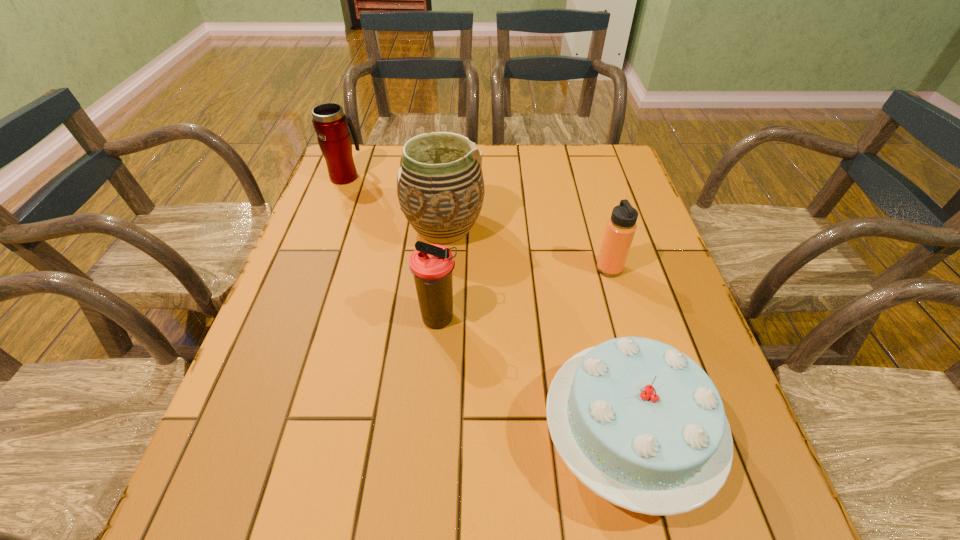
Where is `vacant space located 0.120m on the side with the handle of the farthest thermos bottle`? The width and height of the screenshot is (960, 540). vacant space located 0.120m on the side with the handle of the farthest thermos bottle is located at coordinates (356, 147).

Where is `vacant area situated 0.100m on the side with the handle of the farthest thermos bottle`? Image resolution: width=960 pixels, height=540 pixels. vacant area situated 0.100m on the side with the handle of the farthest thermos bottle is located at coordinates click(355, 150).

This screenshot has height=540, width=960. What are the coordinates of `free space located 0.140m on the front of the second thermos bottle from left to right` in the screenshot? It's located at (432, 399).

Where is `free spot located on the back of the rightmost thermos bottle`? free spot located on the back of the rightmost thermos bottle is located at coordinates (598, 228).

Locate an element on the screen. The width and height of the screenshot is (960, 540). vacant space located on the left of the nearest object is located at coordinates (429, 438).

You are a GUI agent. You are given a task and a screenshot of the screen. Output one action in this format:
    pyautogui.click(x=<x>, y=<y>)
    Task: Click on the object that is at the far edge
    
    Given the screenshot: What is the action you would take?
    pyautogui.click(x=331, y=125)

Where is `object located in the near edge section of the desktop`? The width and height of the screenshot is (960, 540). object located in the near edge section of the desktop is located at coordinates (641, 424).

In order to click on object that is positioned at the left edge in this screenshot , I will do `click(331, 125)`.

This screenshot has width=960, height=540. I want to click on thermos bottle that is at the right edge, so click(621, 227).

This screenshot has width=960, height=540. Find the location of `birthday cake present at the right edge`. birthday cake present at the right edge is located at coordinates (641, 424).